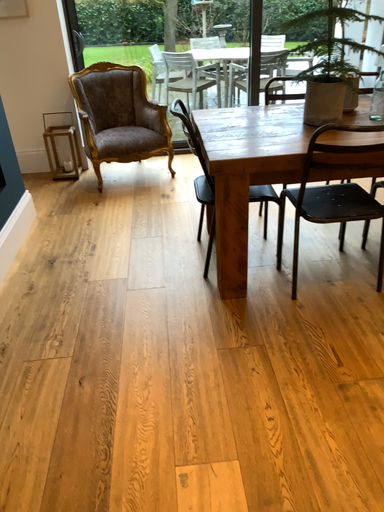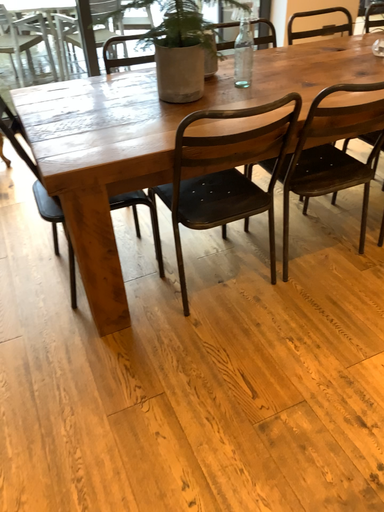
Question: How did the camera likely rotate when shooting the video?

Choices:
 (A) rotated right
 (B) rotated left

Answer: (A)